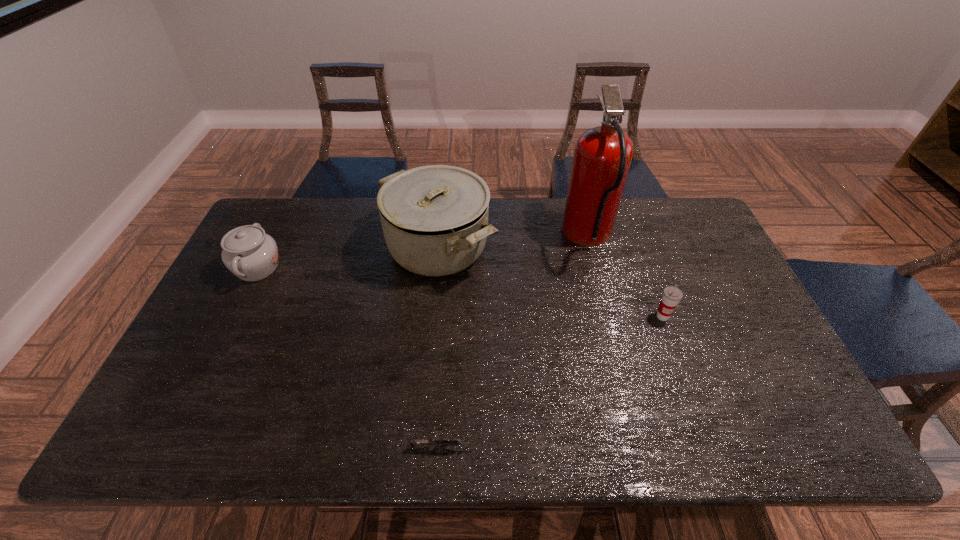
Find the location of a particular element. The width and height of the screenshot is (960, 540). free location located 0.390m with the handle and nozzle on the tallest object is located at coordinates (446, 237).

In order to click on vacant region located 0.080m on the back of the saucepan in this screenshot , I will do `click(444, 198)`.

At what (x,y) coordinates should I click in order to perform the action: click on vacant area situated 0.330m on the right of the leftmost object. Please return your answer as a coordinate pair (x, y). The image size is (960, 540). Looking at the image, I should click on (389, 268).

The width and height of the screenshot is (960, 540). I want to click on vacant space located 0.350m on the side of the second nearest object with the logo, so click(x=711, y=449).

Locate an element on the screen. free space located 0.120m aimed along the barrel of the nearest object is located at coordinates (531, 448).

This screenshot has height=540, width=960. Identify the location of fire extinguisher located at the far edge. (602, 157).

This screenshot has width=960, height=540. I want to click on saucepan that is at the far edge, so click(434, 218).

This screenshot has height=540, width=960. In order to click on object at the near edge in this screenshot , I will do `click(438, 442)`.

The width and height of the screenshot is (960, 540). In order to click on object present at the left edge in this screenshot , I will do `click(248, 252)`.

Find the location of `free spot at the far edge of the desktop`. free spot at the far edge of the desktop is located at coordinates (360, 215).